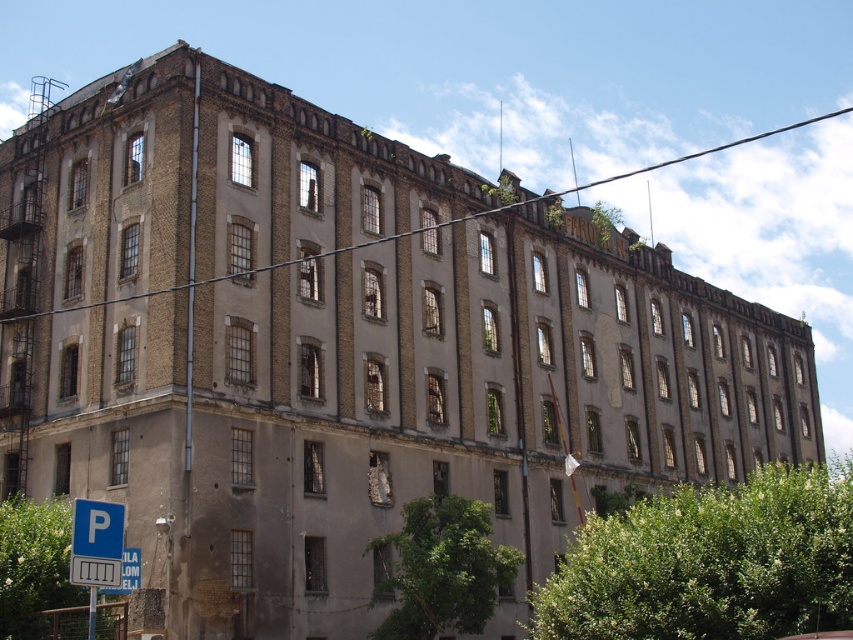
You are standing at the entrance of the industrial building and want to walk towards the parking sign. Which point, point (105,518) or point (125,556), is closer to the parking sign?

Point (105,518) is in front of point (125,556), so it is closer to the parking sign.

You are standing in front of the industrial building and want to find the parking area. Where should you look to find the blue plastic parking sign at lower left?

The blue plastic parking sign at lower left is located at point (96, 544), so you should look towards the lower left direction to find it.